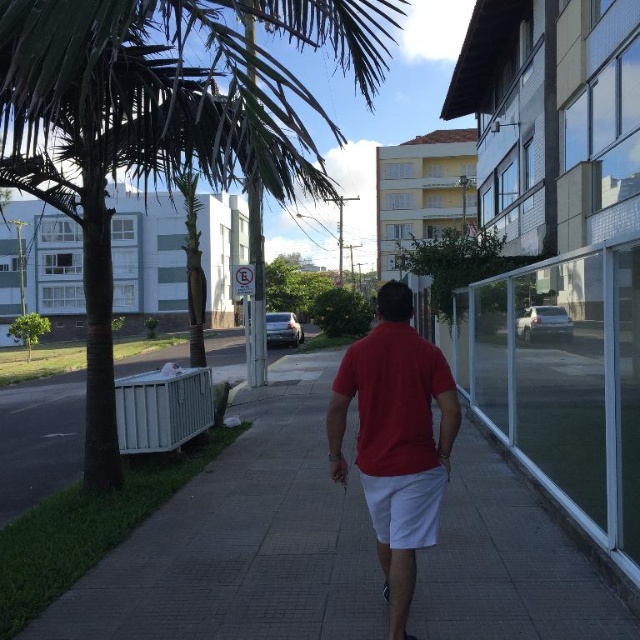
Is gray concrete pavement at center wider than red matte shirt at center?

Indeed, gray concrete pavement at center has a greater width compared to red matte shirt at center.

Is point (113, 618) farther from camera compared to point (378, 529)?

Yes, point (113, 618) is farther from viewer.

Locate an element on the screen. The image size is (640, 640). gray concrete pavement at center is located at coordinates (243, 540).

Describe the element at coordinates (163, 122) in the screenshot. I see `green leafy palm tree at left` at that location.

Does green leafy palm tree at left appear on the left side of red matte shirt at center?

Yes, green leafy palm tree at left is to the left of red matte shirt at center.

Is point (100, 308) behind point (440, 454)?

Yes.

This screenshot has height=640, width=640. Find the location of `green leafy palm tree at left`. green leafy palm tree at left is located at coordinates (163, 122).

Is point (436, 529) positioned in front of point (65, 390)?

Yes, point (436, 529) is in front of point (65, 390).

Is point (404, 602) closer to camera compared to point (42, 461)?

Yes, it is in front of point (42, 461).

Identify the location of red matte shirt at center. Image resolution: width=640 pixels, height=640 pixels. (396, 440).